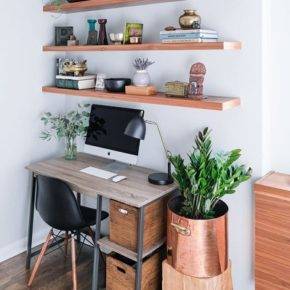
The image size is (290, 290). Identify the location of table leg. (31, 215).